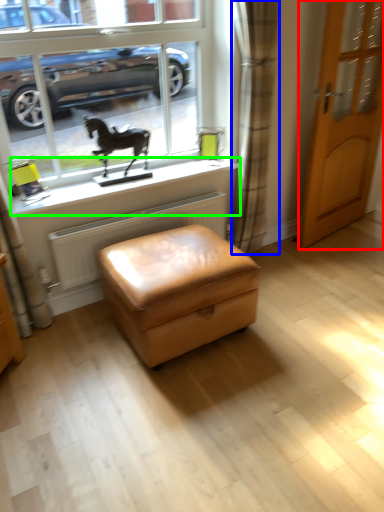
Question: Considering the real-world distances, which object is closest to door (highlighted by a red box)? curtain (highlighted by a blue box) or window sill (highlighted by a green box).

Choices:
 (A) curtain
 (B) window sill

Answer: (A)